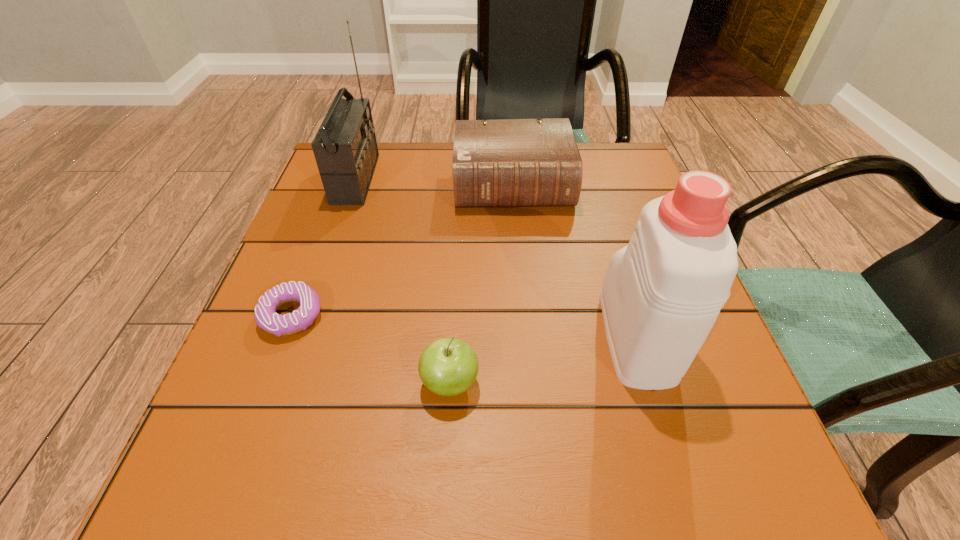
Where is `free point at the right edge`? free point at the right edge is located at coordinates (595, 271).

Where is `free space at the far left corner of the desktop`? free space at the far left corner of the desktop is located at coordinates (380, 181).

The height and width of the screenshot is (540, 960). Identify the location of free spot between the Bible and the shortest object. (402, 251).

The width and height of the screenshot is (960, 540). Find the location of `free area in between the doughnut and the fourth tallest object`. free area in between the doughnut and the fourth tallest object is located at coordinates (371, 349).

This screenshot has width=960, height=540. I want to click on free area in between the shortest object and the detergent, so click(464, 326).

Find the location of a particular element. free area in between the radio receiver and the detergent is located at coordinates (496, 257).

Where is `free space between the Bible and the second shortest object`? The image size is (960, 540). free space between the Bible and the second shortest object is located at coordinates (481, 284).

Identify the location of free spot between the detergent and the radio receiver. (496, 257).

Where is `vacant space in between the shortest object and the apple`? vacant space in between the shortest object and the apple is located at coordinates (371, 349).

Where is `free space between the radio receiver and the Bible`? The image size is (960, 540). free space between the radio receiver and the Bible is located at coordinates (435, 181).